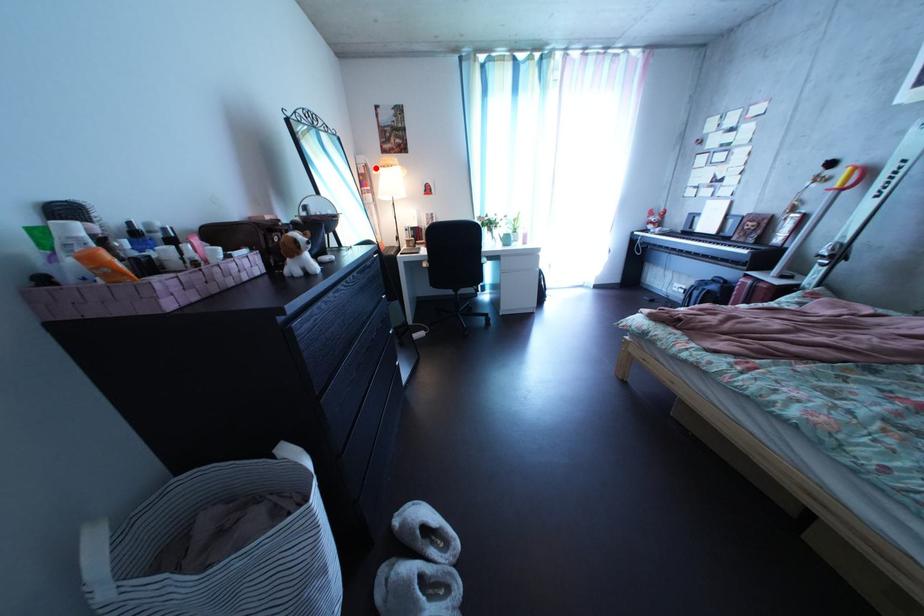
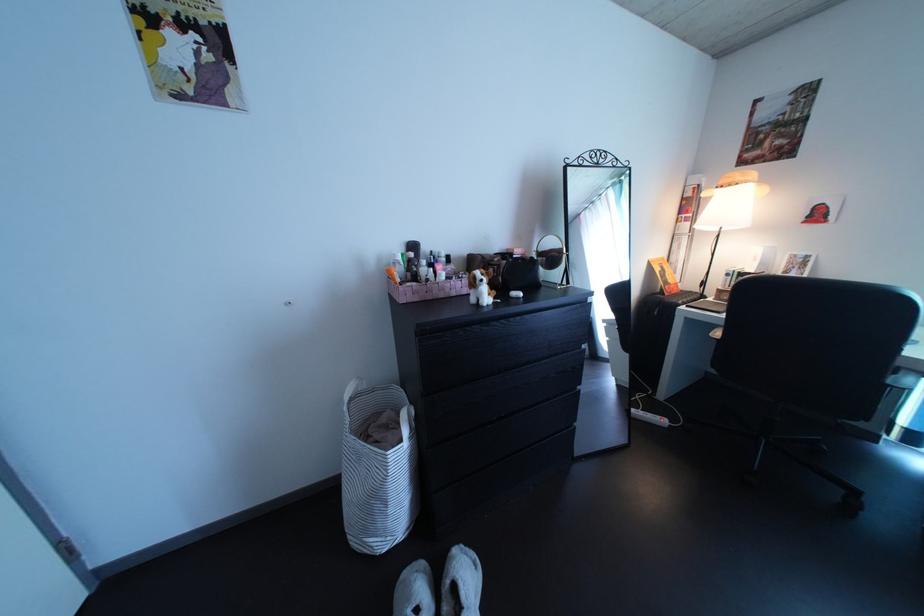
The point at the highlighted location is marked in the first image. Where is the corresponding point in the second image?

(709, 188)